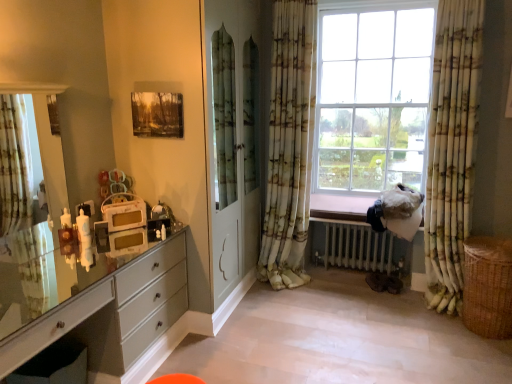
Question: Is matte white clock at left wider than green floral curtain at left, which is the 1th curtain from left to right?

Choices:
 (A) no
 (B) yes

Answer: (B)

Question: Can you confirm if matte white clock at left is positioned to the right of green floral curtain at left, which appears as the 3th curtain when viewed from the right?

Choices:
 (A) yes
 (B) no

Answer: (A)

Question: Considering the relative sizes of matte white clock at left and green floral curtain at left, which appears as the 3th curtain when viewed from the right, in the image provided, is matte white clock at left shorter than green floral curtain at left, which appears as the 3th curtain when viewed from the right,?

Choices:
 (A) no
 (B) yes

Answer: (B)

Question: Can you confirm if matte white clock at left is taller than green floral curtain at left, which appears as the 3th curtain when viewed from the right?

Choices:
 (A) no
 (B) yes

Answer: (A)

Question: Is matte white clock at left far away from green floral curtain at left, which is the 1th curtain from left to right?

Choices:
 (A) no
 (B) yes

Answer: (B)

Question: From the image's perspective, would you say matte white clock at left is positioned over green floral curtain at left, which appears as the 3th curtain when viewed from the right?

Choices:
 (A) yes
 (B) no

Answer: (B)

Question: Is matte white clock at left behind braided wicker basket at lower right?

Choices:
 (A) no
 (B) yes

Answer: (A)

Question: Considering the relative positions of matte white clock at left and braided wicker basket at lower right in the image provided, is matte white clock at left to the right of braided wicker basket at lower right from the viewer's perspective?

Choices:
 (A) yes
 (B) no

Answer: (B)

Question: Does matte white clock at left have a larger size compared to braided wicker basket at lower right?

Choices:
 (A) yes
 (B) no

Answer: (B)

Question: Is matte white clock at left turned away from braided wicker basket at lower right?

Choices:
 (A) yes
 (B) no

Answer: (B)

Question: Can you confirm if matte white clock at left is wider than braided wicker basket at lower right?

Choices:
 (A) no
 (B) yes

Answer: (A)

Question: Is matte white clock at left taller than braided wicker basket at lower right?

Choices:
 (A) no
 (B) yes

Answer: (A)

Question: From a real-world perspective, is braided wicker basket at lower right over green and white textured curtain at right, placed as the 3th curtain when sorted from left to right?

Choices:
 (A) yes
 (B) no

Answer: (B)